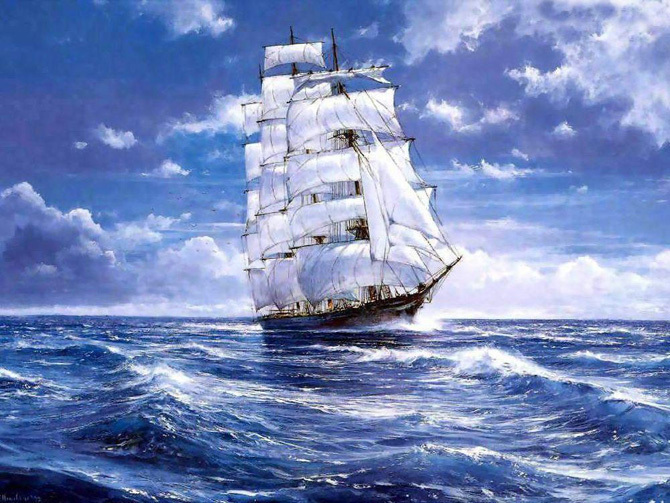
The image size is (670, 503). Identify the location of bottom right corner empty space. (648, 476).